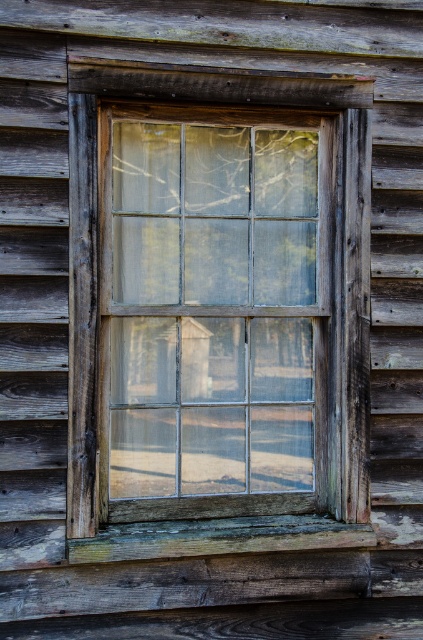
Question: Among these objects, which one is nearest to the camera?

Choices:
 (A) clear glass window at center
 (B) weathered wood at lower center

Answer: (B)

Question: Does clear glass window at center have a larger size compared to weathered wood at lower center?

Choices:
 (A) yes
 (B) no

Answer: (A)

Question: Is clear glass window at center positioned at the back of weathered wood at lower center?

Choices:
 (A) yes
 (B) no

Answer: (A)

Question: Is clear glass window at center in front of weathered wood at lower center?

Choices:
 (A) no
 (B) yes

Answer: (A)

Question: Which object is closer to the camera taking this photo?

Choices:
 (A) clear glass window at center
 (B) weathered wood at lower center

Answer: (B)